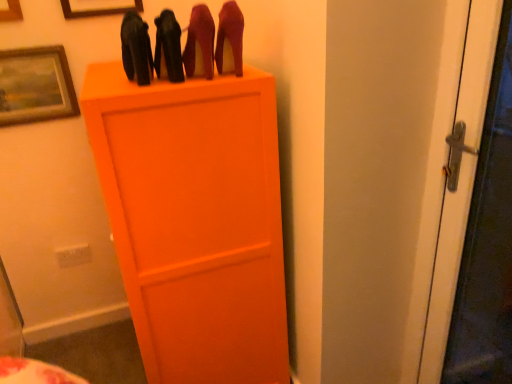
Question: Is matte black shoes at upper center, which is counted as the second stuff, starting from the left, situated inside wooden picture frame at upper left, which appears as the second picture frame when viewed from the top, or outside?

Choices:
 (A) inside
 (B) outside

Answer: (B)

Question: From the image's perspective, is matte black shoes at upper center, which is counted as the second stuff, starting from the left, positioned above or below wooden picture frame at upper left, which appears as the second picture frame when viewed from the top?

Choices:
 (A) below
 (B) above

Answer: (A)

Question: Estimate the real-world distances between objects in this image. Which object is farther from the wooden picture frame at upper left, placed as the first picture frame when sorted from top to bottom?

Choices:
 (A) wooden framed picture at upper left, positioned as the first picture frame in bottom-to-top order
 (B) matte black shoes at upper center, which is counted as the second stuff, starting from the left
 (C) shiny leather high-heels at upper center, the third stuff in the left-to-right sequence
 (D) wooden picture frame at upper left, which appears as the second picture frame when viewed from the top
 (E) matte black high-heels at upper center, which appears as the first stuff when viewed from the left

Answer: (C)

Question: Estimate the real-world distances between objects in this image. Which object is closer to the wooden framed picture at upper left, positioned as the first picture frame in bottom-to-top order?

Choices:
 (A) wooden picture frame at upper left, the third picture frame ordered from the bottom
 (B) matte black high-heels at upper center, which appears as the first stuff when viewed from the left
 (C) shiny leather high-heels at upper center, the third stuff in the left-to-right sequence
 (D) wooden picture frame at upper left, which appears as the second picture frame when viewed from the top
 (E) matte black shoes at upper center, the second stuff when ordered from right to left

Answer: (D)